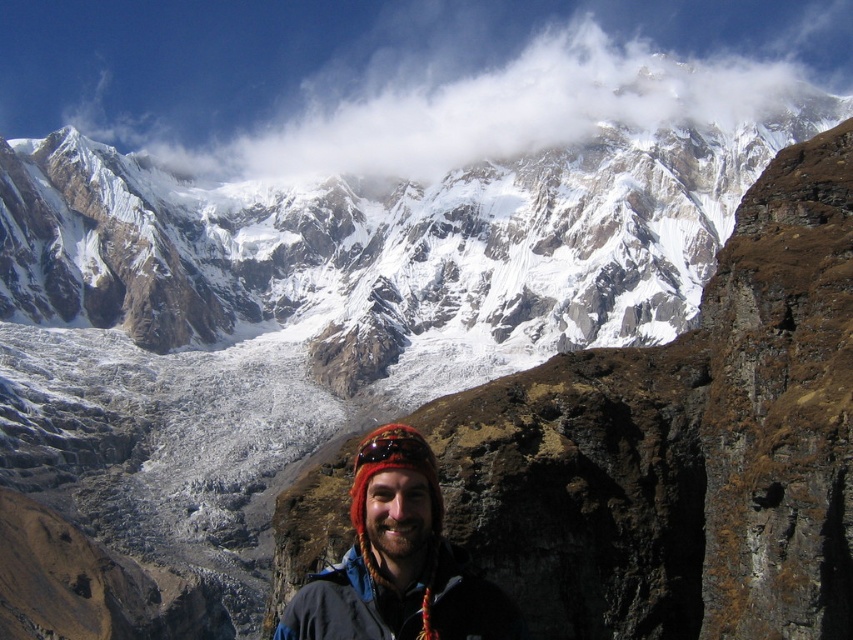
What do you see at coordinates (428, 76) in the screenshot? The image size is (853, 640). I see `white fluffy cloud at upper center` at bounding box center [428, 76].

Is white fluffy cloud at upper center to the left of knitted wool hat at center from the viewer's perspective?

Incorrect, white fluffy cloud at upper center is not on the left side of knitted wool hat at center.

Is point (192, 10) behind point (386, 445)?

That is True.

At what (x,y) coordinates should I click in order to perform the action: click on white fluffy cloud at upper center. Please return your answer as a coordinate pair (x, y). The height and width of the screenshot is (640, 853). Looking at the image, I should click on (428, 76).

Between white fluffy cloud at upper center and dark blue fleece jacket at lower center, which one is positioned higher?

white fluffy cloud at upper center is above.

Measure the distance from white fluffy cloud at upper center to dark blue fleece jacket at lower center.

white fluffy cloud at upper center is 544.79 feet from dark blue fleece jacket at lower center.

Describe the element at coordinates (428, 76) in the screenshot. I see `white fluffy cloud at upper center` at that location.

This screenshot has width=853, height=640. What are the coordinates of `white fluffy cloud at upper center` in the screenshot? It's located at (428, 76).

Measure the distance between knitted wool hat at center and camera.

knitted wool hat at center is 59.14 meters from camera.

Between knitted wool hat at center and dark blue fleece jacket at lower center, which one has less height?

Standing shorter between the two is dark blue fleece jacket at lower center.

Measure the distance between point (337, 580) and camera.

Point (337, 580) is 206.34 feet away from camera.

You are a GUI agent. You are given a task and a screenshot of the screen. Output one action in this format:
    pyautogui.click(x=<x>, y=<y>)
    Task: Click on the knitted wool hat at center
    The height and width of the screenshot is (640, 853).
    Given the screenshot: What is the action you would take?
    pyautogui.click(x=398, y=561)